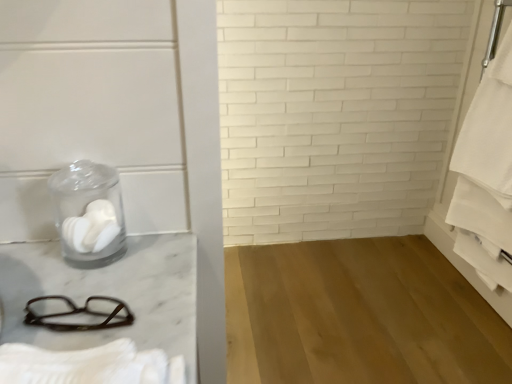
Based on the photo, measure the distance between point [82,327] and camera.

Point [82,327] and camera are 55.20 centimeters apart from each other.

At what (x,y) coordinates should I click in order to perform the action: click on white cotton bath towel at right, which is counted as the second bath towel, starting from the bottom. Please return your answer as a coordinate pair (x, y). This screenshot has width=512, height=384. Looking at the image, I should click on (489, 130).

Where is `transparent glass jar at left`? Image resolution: width=512 pixels, height=384 pixels. transparent glass jar at left is located at coordinates (88, 210).

At what (x,y) coordinates should I click in order to perform the action: click on white cotton bath towel at lower left, positioned as the first bath towel in left-to-right order. Please return your answer as a coordinate pair (x, y). Looking at the image, I should click on (89, 365).

The height and width of the screenshot is (384, 512). What do you see at coordinates (92, 227) in the screenshot?
I see `white matte toilet paper at left` at bounding box center [92, 227].

Where is `brown plastic glasses at lower left`? The height and width of the screenshot is (384, 512). brown plastic glasses at lower left is located at coordinates (79, 313).

Between transparent glass jar at left and white cotton bath towel at right, the first bath towel from the back, which one is positioned in front?

transparent glass jar at left is closer to the camera.

In the scene shown: Considering the relative sizes of transparent glass jar at left and white cotton bath towel at right, the 1th bath towel in the right-to-left sequence, in the image provided, is transparent glass jar at left shorter than white cotton bath towel at right, the 1th bath towel in the right-to-left sequence,?

Indeed, transparent glass jar at left has a lesser height compared to white cotton bath towel at right, the 1th bath towel in the right-to-left sequence.

From a real-world perspective, which bath towel is the 2nd one underneath the transparent glass jar at left? Please provide its 2D coordinates.

[(489, 130)]

Considering the relative positions of transparent glass jar at left and white cotton bath towel at lower left, marked as the 1th bath towel in a bottom-to-top arrangement, in the image provided, is transparent glass jar at left to the left of white cotton bath towel at lower left, marked as the 1th bath towel in a bottom-to-top arrangement, from the viewer's perspective?

Indeed, transparent glass jar at left is positioned on the left side of white cotton bath towel at lower left, marked as the 1th bath towel in a bottom-to-top arrangement.

Can you confirm if transparent glass jar at left is taller than white cotton bath towel at lower left, the 1th bath towel positioned from the front?

Yes.

From a real-world perspective, is transparent glass jar at left on top of white cotton bath towel at lower left, acting as the second bath towel starting from the back?

Yes, from a real-world perspective, transparent glass jar at left is over white cotton bath towel at lower left, acting as the second bath towel starting from the back

The image size is (512, 384). Identify the location of the 1st bath towel to the right when counting from the transparent glass jar at left. (89, 365).

From the image's perspective, relative to brown plastic glasses at lower left, is white matte toilet paper at left above or below?

white matte toilet paper at left is above brown plastic glasses at lower left.

Is white matte toilet paper at left turned away from brown plastic glasses at lower left?

No, white matte toilet paper at left's orientation is not away from brown plastic glasses at lower left.

Where is `toilet paper above the brown plastic glasses at lower left (from a real-world perspective)`? Image resolution: width=512 pixels, height=384 pixels. toilet paper above the brown plastic glasses at lower left (from a real-world perspective) is located at coordinates (92, 227).

Are white cotton bath towel at right, the 1th bath towel in the right-to-left sequence, and white cotton bath towel at lower left, which is the 2th bath towel from top to bottom, beside each other?

No, white cotton bath towel at right, the 1th bath towel in the right-to-left sequence, is not in contact with white cotton bath towel at lower left, which is the 2th bath towel from top to bottom.

Is white cotton bath towel at right, which is counted as the second bath towel, starting from the bottom, located outside white cotton bath towel at lower left, marked as the 1th bath towel in a bottom-to-top arrangement?

Yes, white cotton bath towel at right, which is counted as the second bath towel, starting from the bottom, is located beyond the bounds of white cotton bath towel at lower left, marked as the 1th bath towel in a bottom-to-top arrangement.

Considering the sizes of objects white cotton bath towel at right, which is counted as the second bath towel, starting from the bottom, and white cotton bath towel at lower left, the 1th bath towel positioned from the front, in the image provided, who is thinner, white cotton bath towel at right, which is counted as the second bath towel, starting from the bottom, or white cotton bath towel at lower left, the 1th bath towel positioned from the front,?

white cotton bath towel at right, which is counted as the second bath towel, starting from the bottom, is thinner.

Does white cotton bath towel at right, which is counted as the first bath towel, starting from the top, have a larger size compared to white cotton bath towel at lower left, positioned as the first bath towel in left-to-right order?

Yes.

Considering the sizes of white cotton bath towel at right, which is counted as the first bath towel, starting from the top, and white matte toilet paper at left in the image, is white cotton bath towel at right, which is counted as the first bath towel, starting from the top, wider or thinner than white matte toilet paper at left?

Clearly, white cotton bath towel at right, which is counted as the first bath towel, starting from the top, has more width compared to white matte toilet paper at left.

Considering the sizes of objects white cotton bath towel at right, the first bath towel from the back, and white matte toilet paper at left in the image provided, who is taller, white cotton bath towel at right, the first bath towel from the back, or white matte toilet paper at left?

With more height is white cotton bath towel at right, the first bath towel from the back.

Would you say white matte toilet paper at left is part of white cotton bath towel at right, the first bath towel from the back,'s contents?

That's incorrect, white matte toilet paper at left is not inside white cotton bath towel at right, the first bath towel from the back.

Does white cotton bath towel at right, the second bath towel viewed from the left, have a larger size compared to white matte toilet paper at left?

Correct, white cotton bath towel at right, the second bath towel viewed from the left, is larger in size than white matte toilet paper at left.

Is brown plastic glasses at lower left turned away from white matte toilet paper at left?

Yes, brown plastic glasses at lower left is facing away from white matte toilet paper at left.

From the picture: Is brown plastic glasses at lower left in front of or behind white matte toilet paper at left in the image?

Visually, brown plastic glasses at lower left is located in front of white matte toilet paper at left.

Is point (112, 322) behind point (95, 230)?

No, it is in front of (95, 230).

Looking at this image, from a real-world perspective, which is physically below, brown plastic glasses at lower left or white matte toilet paper at left?

brown plastic glasses at lower left, from a real-world perspective.

From the picture: Does white cotton bath towel at lower left, marked as the 1th bath towel in a bottom-to-top arrangement, have a lesser height compared to brown plastic glasses at lower left?

No, white cotton bath towel at lower left, marked as the 1th bath towel in a bottom-to-top arrangement, is not shorter than brown plastic glasses at lower left.

In the scene shown: Could you tell me if white cotton bath towel at lower left, the 1th bath towel positioned from the front, is turned towards brown plastic glasses at lower left?

No, white cotton bath towel at lower left, the 1th bath towel positioned from the front, is not oriented towards brown plastic glasses at lower left.

Is point (28, 373) positioned behind point (123, 302)?

No, it is in front of (123, 302).

Can you tell me how much white cotton bath towel at lower left, acting as the second bath towel starting from the back, and brown plastic glasses at lower left differ in facing direction?

0.00249 degrees.

The height and width of the screenshot is (384, 512). Find the location of `bath towel behind the transparent glass jar at left`. bath towel behind the transparent glass jar at left is located at coordinates (489, 130).

In the image, there is a white cotton bath towel at lower left, the 1th bath towel positioned from the front. At what (x,y) coordinates should I click in order to perform the action: click on glass jar above it (from the image's perspective). Please return your answer as a coordinate pair (x, y). Looking at the image, I should click on (88, 210).

From the image, which object appears to be nearer to brown plastic glasses at lower left, white cotton bath towel at right, the 1th bath towel in the right-to-left sequence, or white matte toilet paper at left?

The object closer to brown plastic glasses at lower left is white matte toilet paper at left.

Looking at the image, which one is located further to white cotton bath towel at lower left, positioned as the first bath towel in left-to-right order, white matte toilet paper at left or white cotton bath towel at right, which is counted as the second bath towel, starting from the bottom?

Among the two, white cotton bath towel at right, which is counted as the second bath towel, starting from the bottom, is located further to white cotton bath towel at lower left, positioned as the first bath towel in left-to-right order.

When comparing their distances from white cotton bath towel at right, the 1th bath towel in the right-to-left sequence, does white matte toilet paper at left or transparent glass jar at left seem further?

white matte toilet paper at left is further to white cotton bath towel at right, the 1th bath towel in the right-to-left sequence.

Consider the image. Looking at the image, which one is located further to brown plastic glasses at lower left, white cotton bath towel at lower left, acting as the second bath towel starting from the back, or white matte toilet paper at left?

Based on the image, white matte toilet paper at left appears to be further to brown plastic glasses at lower left.

Estimate the real-world distances between objects in this image. Which object is closer to transparent glass jar at left, white matte toilet paper at left or white cotton bath towel at lower left, which is the 2th bath towel from top to bottom?

white matte toilet paper at left lies closer to transparent glass jar at left than the other object.

From the image, which object appears to be farther from white matte toilet paper at left, white cotton bath towel at lower left, which is the 2th bath towel from top to bottom, or brown plastic glasses at lower left?

white cotton bath towel at lower left, which is the 2th bath towel from top to bottom, is further to white matte toilet paper at left.

Which object lies further to the anchor point brown plastic glasses at lower left, white cotton bath towel at right, the first bath towel from the back, or white cotton bath towel at lower left, which is the 2th bath towel from top to bottom?

white cotton bath towel at right, the first bath towel from the back, lies further to brown plastic glasses at lower left than the other object.

Which object lies further to the anchor point brown plastic glasses at lower left, transparent glass jar at left or white cotton bath towel at right, the first bath towel from the back?

Among the two, white cotton bath towel at right, the first bath towel from the back, is located further to brown plastic glasses at lower left.

Locate an element on the screen. The image size is (512, 384). glasses between transparent glass jar at left and white cotton bath towel at right, the first bath towel from the back, in the horizontal direction is located at coordinates (79, 313).

Find the location of a particular element. This screenshot has width=512, height=384. glass jar between white matte toilet paper at left and white cotton bath towel at right, which is counted as the second bath towel, starting from the bottom, in the horizontal direction is located at coordinates (88, 210).

Where is `glasses situated between white matte toilet paper at left and white cotton bath towel at right, the second bath towel viewed from the left, from left to right`? This screenshot has width=512, height=384. glasses situated between white matte toilet paper at left and white cotton bath towel at right, the second bath towel viewed from the left, from left to right is located at coordinates (79, 313).

This screenshot has width=512, height=384. Identify the location of toilet paper between transparent glass jar at left and brown plastic glasses at lower left in the vertical direction. (92, 227).